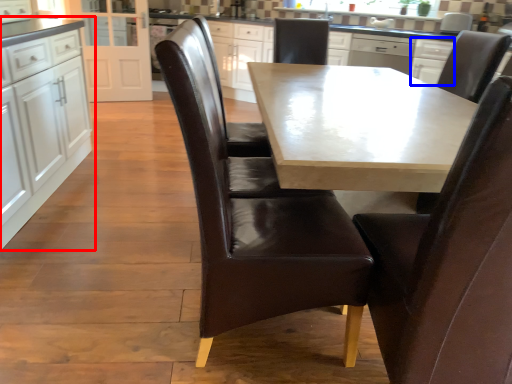
Question: Which object is closer to the camera taking this photo, cabinetry (highlighted by a red box) or cabinetry (highlighted by a blue box)?

Choices:
 (A) cabinetry
 (B) cabinetry

Answer: (A)